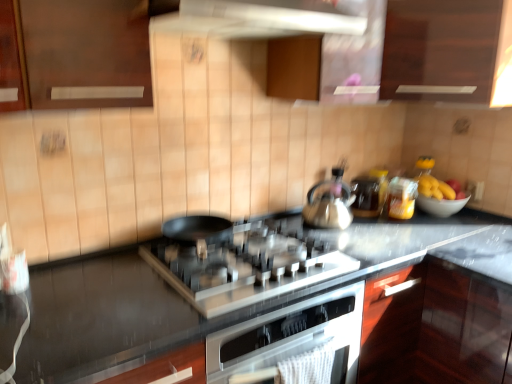
Where is `free space in front of matte yellow jar at upper right, the 2th appliance in the left-to-right sequence`? The image size is (512, 384). free space in front of matte yellow jar at upper right, the 2th appliance in the left-to-right sequence is located at coordinates (410, 234).